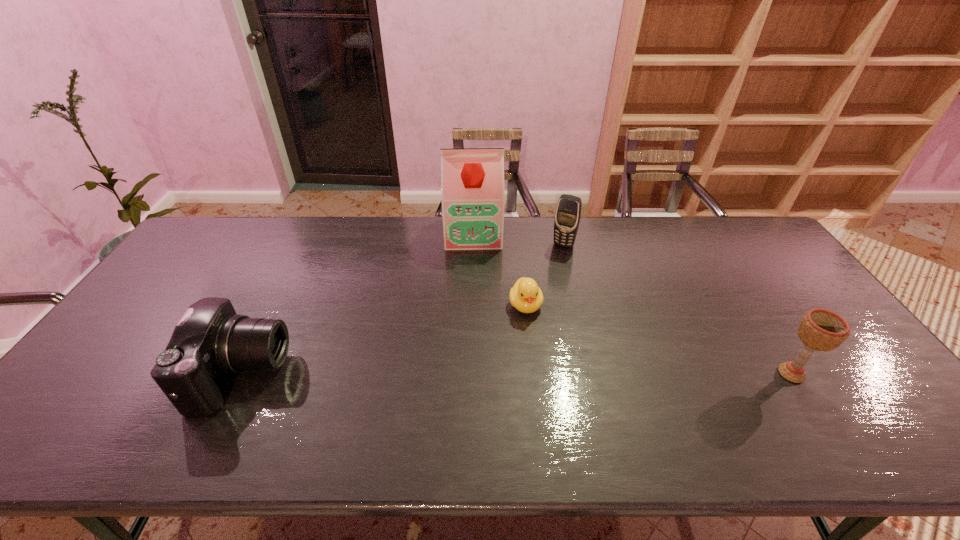
Where is `the leftmost object`? This screenshot has height=540, width=960. the leftmost object is located at coordinates [210, 341].

This screenshot has height=540, width=960. Identify the location of chalice. (x=822, y=330).

The image size is (960, 540). Find the location of `duckling`. duckling is located at coordinates (526, 296).

Where is `the shortest object`? the shortest object is located at coordinates (526, 296).

This screenshot has width=960, height=540. Identify the location of cellular telephone. (568, 212).

Where is `soya milk`? The height and width of the screenshot is (540, 960). soya milk is located at coordinates (472, 180).

Image resolution: width=960 pixels, height=540 pixels. Identify the location of the tallest object. (472, 180).

Identify the location of vacant space located on the lens of the leftmost object. The image size is (960, 540). [x=373, y=375].

Find the location of `vacant area located on the right of the rightmost object`. vacant area located on the right of the rightmost object is located at coordinates (837, 374).

Identify the location of vacant region located on the beak of the shortest object. (538, 363).